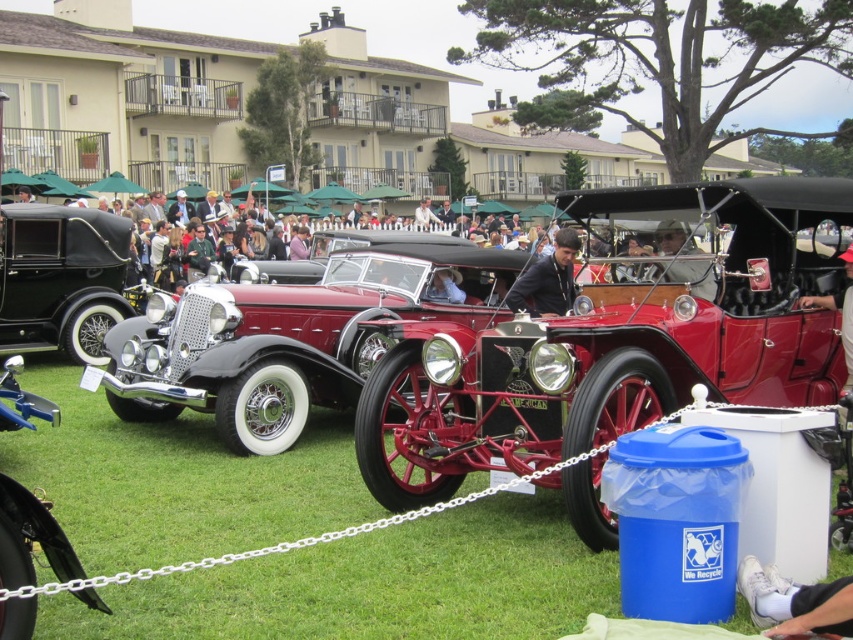
Measure the distance between point (376,419) and camera.

24.88 feet

Between point (381, 502) and point (756, 573), which one is positioned in front?

Point (756, 573) is more forward.

This screenshot has height=640, width=853. I want to click on shiny red car at center, so click(x=622, y=337).

Does shiny black car at left have a smaller size compared to white fabric shoe at lower right?

Incorrect, shiny black car at left is not smaller in size than white fabric shoe at lower right.

This screenshot has width=853, height=640. What do you see at coordinates (61, 278) in the screenshot?
I see `shiny black car at left` at bounding box center [61, 278].

Identify the location of shiny black car at left. Image resolution: width=853 pixels, height=640 pixels. (61, 278).

Which is below, shiny red car at center or shiny chrome car at center?

shiny red car at center is lower down.

Between shiny red car at center and shiny chrome car at center, which one appears on the left side from the viewer's perspective?

From the viewer's perspective, shiny chrome car at center appears more on the left side.

This screenshot has width=853, height=640. What do you see at coordinates (622, 337) in the screenshot?
I see `shiny red car at center` at bounding box center [622, 337].

Where is `shiny red car at center`? Image resolution: width=853 pixels, height=640 pixels. shiny red car at center is located at coordinates (622, 337).